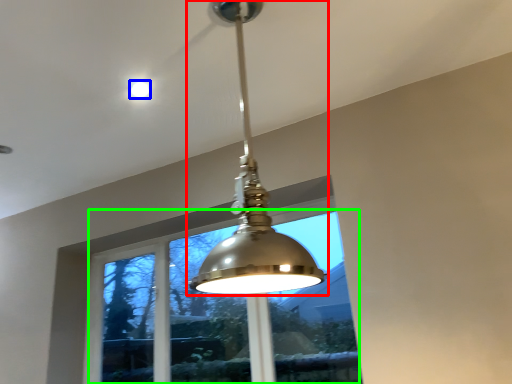
Question: Which object is the closest to the lamp (highlighted by a red box)? Choose among these: droplight (highlighted by a blue box) or window (highlighted by a green box).

Choices:
 (A) droplight
 (B) window

Answer: (A)